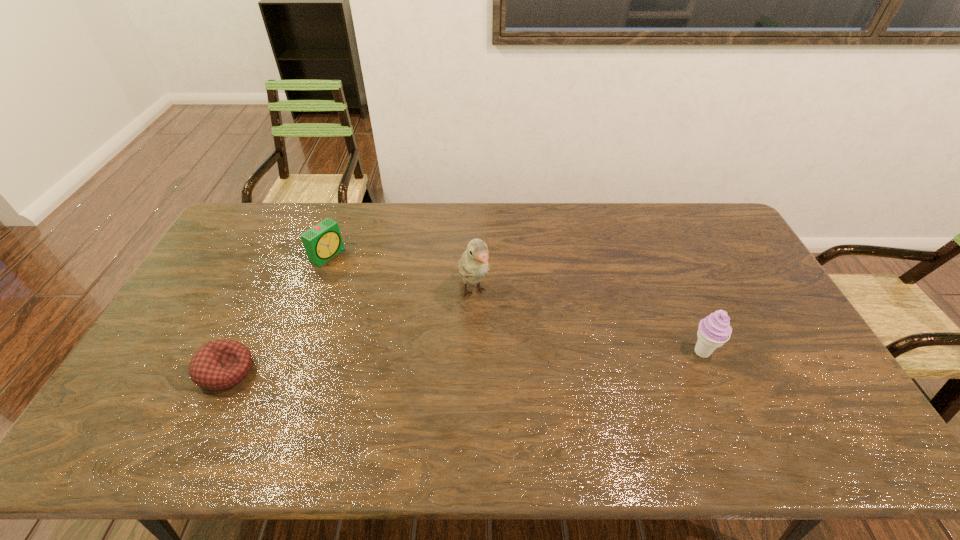
Identify the location of vacant space at the near edge of the desktop. The width and height of the screenshot is (960, 540). (456, 405).

You are a GUI agent. You are given a task and a screenshot of the screen. Output one action in this format:
    pyautogui.click(x=<x>, y=<y>)
    Task: Click on the free space at the left edge
    The height and width of the screenshot is (540, 960).
    Given the screenshot: What is the action you would take?
    pyautogui.click(x=218, y=304)

Locate an element on the screen. free space at the near left corner of the desktop is located at coordinates (148, 404).

The width and height of the screenshot is (960, 540). Find the location of `empty space between the alarm clock and the beanbag`. empty space between the alarm clock and the beanbag is located at coordinates (276, 313).

You are a GUI agent. You are given a task and a screenshot of the screen. Output one action in this format:
    pyautogui.click(x=<x>, y=<y>)
    Task: Click on the free space between the beanbag and the third shortest object
    The image size is (960, 540).
    Given the screenshot: What is the action you would take?
    [464, 362]

The image size is (960, 540). What are the coordinates of `blank region between the second object from left to right and the beanbag` in the screenshot? It's located at (276, 313).

The height and width of the screenshot is (540, 960). I want to click on free spot between the tallest object and the alarm clock, so click(x=400, y=274).

Where is `free area in between the alarm clock and the leftmost object`? The width and height of the screenshot is (960, 540). free area in between the alarm clock and the leftmost object is located at coordinates (276, 313).

Locate an element on the screen. vacant area between the beanbag and the second object from left to right is located at coordinates (276, 313).

This screenshot has width=960, height=540. I want to click on free spot between the shortest object and the tallest object, so click(350, 332).